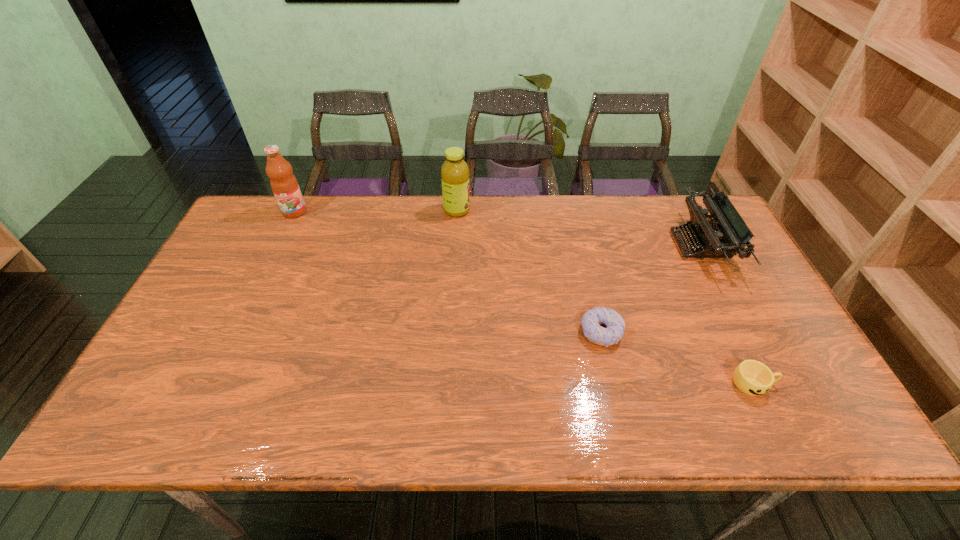
What are the coordinates of `the leftmost object` in the screenshot? It's located at (284, 184).

Identify the location of the second object from left to right. (455, 173).

I want to click on the third tallest object, so [x=725, y=235].

The width and height of the screenshot is (960, 540). Find the location of `doughnut`. doughnut is located at coordinates (595, 333).

The height and width of the screenshot is (540, 960). In order to click on the third object from right to left in this screenshot , I will do `click(595, 333)`.

You are a GUI agent. You are given a task and a screenshot of the screen. Output one action in this format:
    pyautogui.click(x=<x>, y=<y>)
    Task: Click on the cup
    
    Given the screenshot: What is the action you would take?
    pyautogui.click(x=752, y=377)

Locate an element on the screen. This screenshot has height=540, width=960. vacant space located on the front label of the left fruit juice is located at coordinates (282, 237).

At what (x,y) coordinates should I click in order to perform the action: click on vacant space situated on the front label of the right fruit juice. Please return your answer as a coordinate pair (x, y). The height and width of the screenshot is (540, 960). Looking at the image, I should click on (521, 210).

I want to click on vacant area located 0.180m on the typing side of the typewriter, so click(x=616, y=245).

At what (x,y) coordinates should I click in order to perform the action: click on vacant area located 0.120m on the typing side of the typewriter. Please return your answer as a coordinate pair (x, y). Looking at the image, I should click on (636, 245).